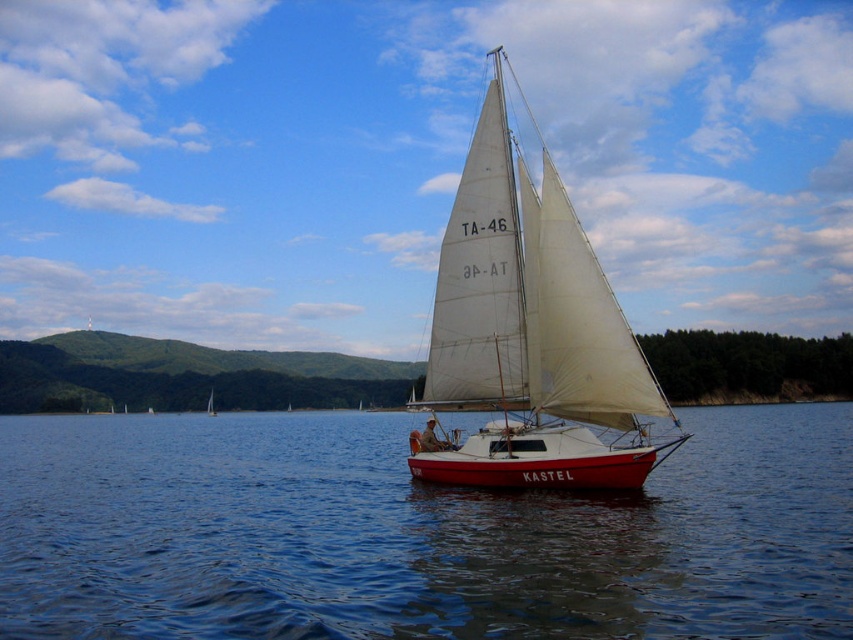
Question: Is white canvas sailboat at center thinner than white sailboat at center?

Choices:
 (A) yes
 (B) no

Answer: (B)

Question: Does white canvas sailboat at center appear over white sailboat at center?

Choices:
 (A) yes
 (B) no

Answer: (A)

Question: Which object is positioned farthest from the smooth blue water at center?

Choices:
 (A) white sailboat at center
 (B) white canvas sailboat at center

Answer: (A)

Question: Which object is closer to the camera taking this photo?

Choices:
 (A) white canvas sailboat at center
 (B) white sailboat at center

Answer: (A)

Question: Can you confirm if white canvas sailboat at center is positioned below white sailboat at center?

Choices:
 (A) no
 (B) yes

Answer: (A)

Question: Which object is positioned farthest from the white canvas sailboat at center?

Choices:
 (A) white sailboat at center
 (B) smooth blue water at center

Answer: (A)